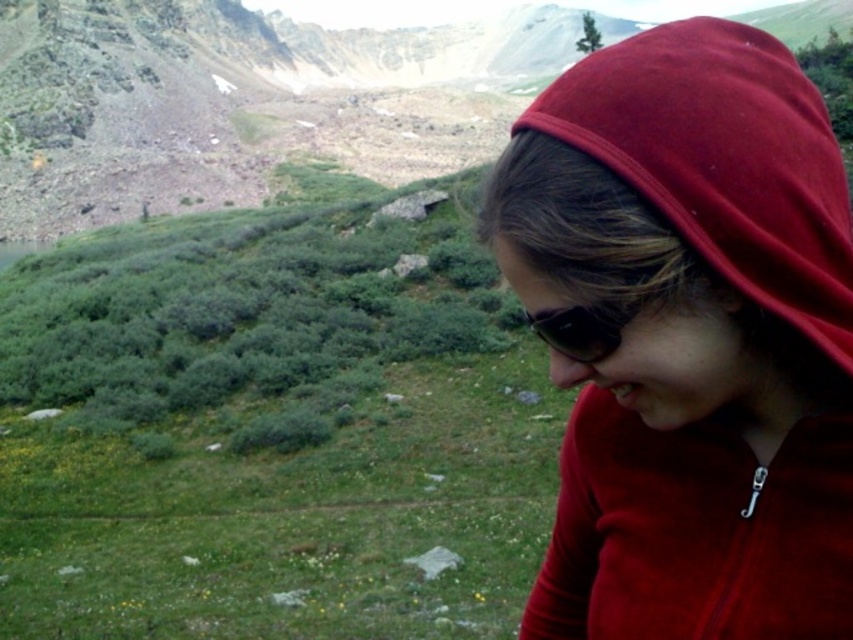
Question: Can you confirm if matte red hoodie at right is positioned to the left of black reflective sunglasses at lower right?

Choices:
 (A) yes
 (B) no

Answer: (B)

Question: Which point is closer to the camera?

Choices:
 (A) matte red hoodie at right
 (B) black reflective sunglasses at lower right

Answer: (A)

Question: Is matte red hoodie at right wider than black reflective sunglasses at lower right?

Choices:
 (A) yes
 (B) no

Answer: (A)

Question: Can you confirm if matte red hoodie at right is positioned to the left of black reflective sunglasses at lower right?

Choices:
 (A) no
 (B) yes

Answer: (A)

Question: Which point appears farthest from the camera in this image?

Choices:
 (A) (659, 592)
 (B) (548, 339)

Answer: (B)